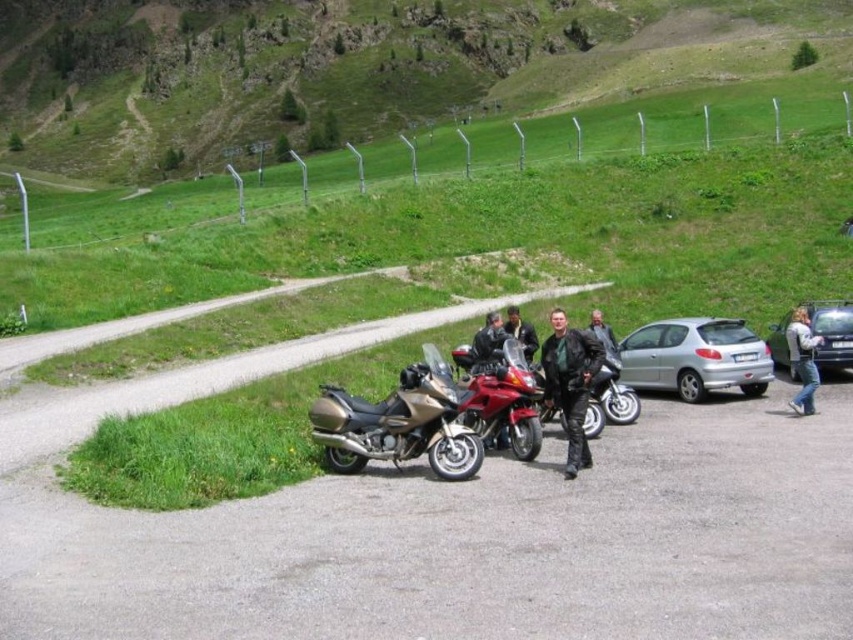
Question: Does black leather jacket at center have a smaller size compared to dark brown leather jacket at center?

Choices:
 (A) yes
 (B) no

Answer: (B)

Question: Which point is closer to the camera taking this photo?

Choices:
 (A) (799, 412)
 (B) (483, 433)
 (C) (460, 426)

Answer: (C)

Question: Is gravel road at center wider than shiny red motorcycle at center?

Choices:
 (A) yes
 (B) no

Answer: (A)

Question: Is silver metallic hatchback at center-right positioned behind jeans at lower right?

Choices:
 (A) yes
 (B) no

Answer: (A)

Question: Which of the following is the closest to the observer?

Choices:
 (A) shiny red motorcycle at center
 (B) green grass at upper center

Answer: (A)

Question: Which object is the closest to the shiny red motorcycle at center?

Choices:
 (A) gravel road at center
 (B) silver metallic sedan at right

Answer: (A)